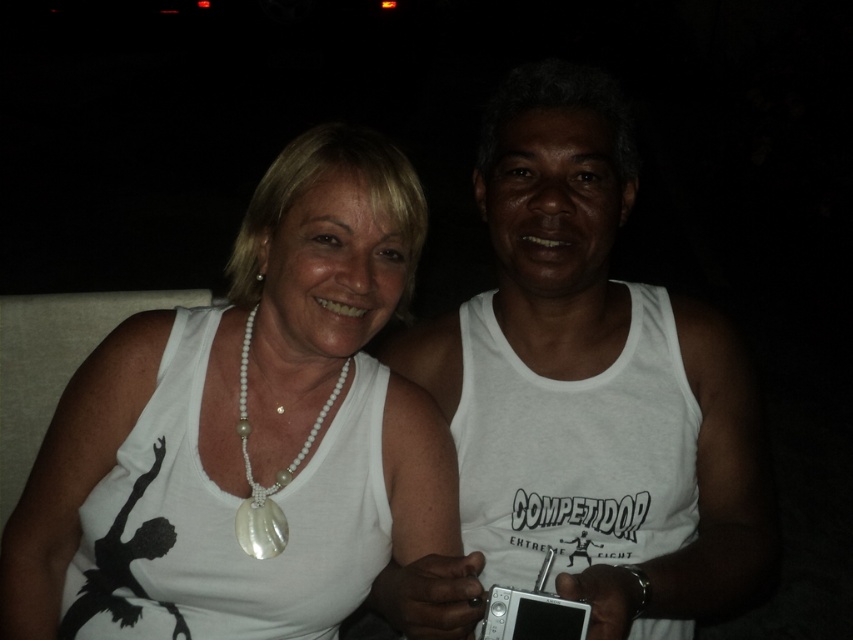
You are a photographer adjusting the lighting for a portrait. You notice the white pearl necklace at upper left and the white matte tank top at right. Which object should you focus on to ensure the subject on the right is properly lit?

The white matte tank top at right is behind the white pearl necklace at upper left, so focusing on the subject on the right would require adjusting the lighting to account for the tank top being in the background. However, since the question asks which object to focus on for proper lighting on the right subject, the correct focus should be on the white pearl necklace at upper left to ensure it doesn t block or cast shadows on the tank top.

Based on the photo, you are a photographer adjusting the focus on your camera. You need to ensure that the white pearl necklace at upper left is in sharp focus. Given that the camera can only focus precisely on objects within a 0.1 unit radius around the point specified, will the focus point at coordinates point (247, 429) be sufficient to capture the white pearl necklace at upper left clearly?

The point (247, 429) marks the white pearl necklace at upper left. Since the focus point is exactly at this coordinate, the white pearl necklace at upper left will be in sharp focus as it is within the 0.1 unit radius required for precise focus.

In the scene shown: You are a photographer adjusting the lighting for a portrait. You notice a specific point at coordinates (583, 396) on the image. Based on the scene description, where is this point located?

The point at (583, 396) is located on the white matte tank top at right.